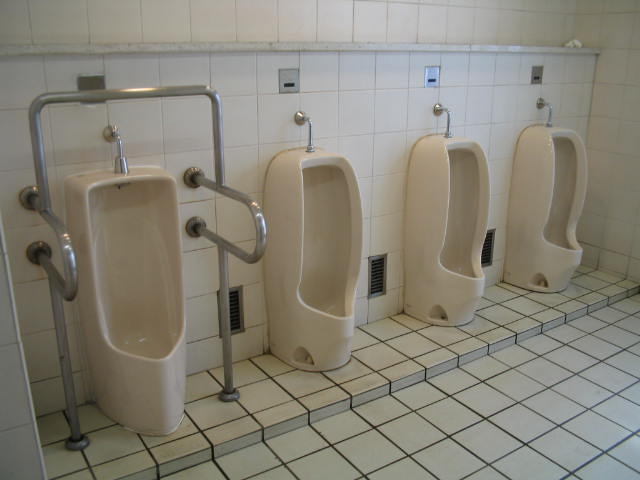
I want to click on urinal, so click(x=154, y=303), click(x=316, y=272), click(x=449, y=241), click(x=562, y=214).